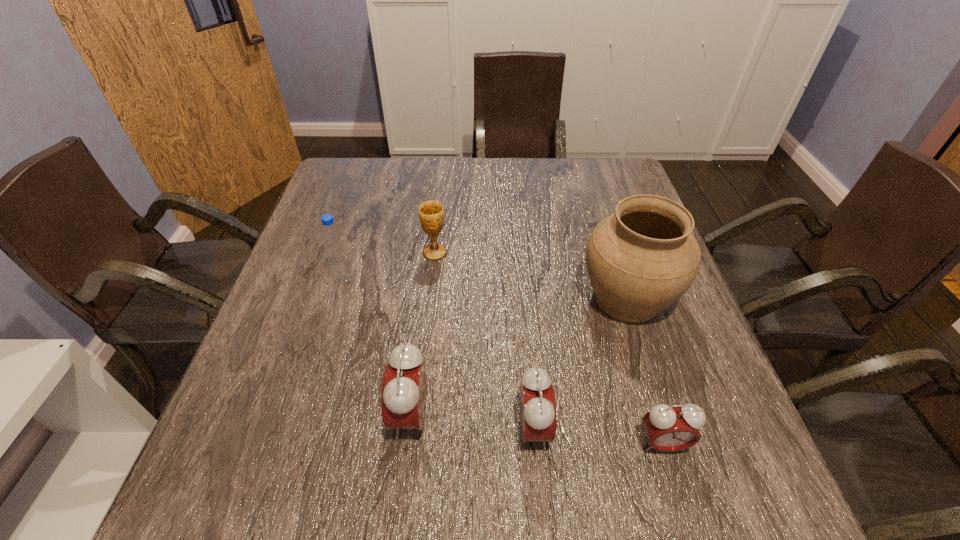
Image resolution: width=960 pixels, height=540 pixels. What are the coordinates of `free space at the left edge of the desktop` in the screenshot? It's located at (321, 242).

In the image, there is a desktop. Find the location of `blank space at the right edge`. blank space at the right edge is located at coordinates (680, 345).

Image resolution: width=960 pixels, height=540 pixels. Find the location of `free space at the near left corner of the desktop`. free space at the near left corner of the desktop is located at coordinates (312, 422).

Find the location of a particular element. Image resolution: width=960 pixels, height=540 pixels. free space at the far right corner of the desktop is located at coordinates (595, 167).

Locate an element on the screen. The image size is (960, 540). free space between the leftmost alarm clock and the second alarm clock from left to right is located at coordinates (472, 422).

The image size is (960, 540). I want to click on free space that is in between the second shortest alarm clock and the chalice, so click(x=484, y=341).

Image resolution: width=960 pixels, height=540 pixels. What are the coordinates of `free point between the leftmost alarm clock and the tallest object` in the screenshot? It's located at (518, 356).

Locate an element on the screen. This screenshot has height=540, width=960. unoccupied position between the urn and the shortest alarm clock is located at coordinates (644, 370).

The width and height of the screenshot is (960, 540). What are the coordinates of `free space between the leftmost alarm clock and the chalice` in the screenshot? It's located at (422, 334).

The width and height of the screenshot is (960, 540). I want to click on vacant point located between the tallest object and the leftmost alarm clock, so tap(518, 356).